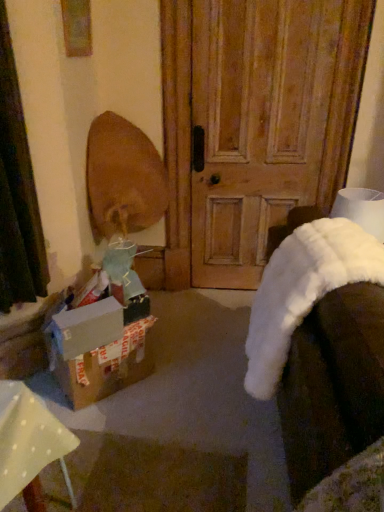
Question: From the image's perspective, is brown cardboard box at lower left below wooden door at center?

Choices:
 (A) no
 (B) yes

Answer: (B)

Question: Considering the relative sizes of brown cardboard box at lower left and wooden door at center in the image provided, is brown cardboard box at lower left taller than wooden door at center?

Choices:
 (A) yes
 (B) no

Answer: (B)

Question: Is brown cardboard box at lower left positioned beyond the bounds of wooden door at center?

Choices:
 (A) yes
 (B) no

Answer: (A)

Question: Considering the relative sizes of brown cardboard box at lower left and wooden door at center in the image provided, is brown cardboard box at lower left bigger than wooden door at center?

Choices:
 (A) yes
 (B) no

Answer: (B)

Question: Is brown cardboard box at lower left further to the viewer compared to wooden door at center?

Choices:
 (A) no
 (B) yes

Answer: (A)

Question: Is brown cardboard box at lower left facing towards wooden door at center?

Choices:
 (A) no
 (B) yes

Answer: (A)

Question: Can you confirm if brown cardboard box at lower left is smaller than white fluffy blanket at lower right?

Choices:
 (A) yes
 (B) no

Answer: (A)

Question: Is brown cardboard box at lower left bigger than white fluffy blanket at lower right?

Choices:
 (A) no
 (B) yes

Answer: (A)

Question: From a real-world perspective, is brown cardboard box at lower left on white fluffy blanket at lower right?

Choices:
 (A) yes
 (B) no

Answer: (B)

Question: From the image's perspective, is brown cardboard box at lower left located beneath white fluffy blanket at lower right?

Choices:
 (A) no
 (B) yes

Answer: (B)

Question: Considering the relative sizes of brown cardboard box at lower left and white fluffy blanket at lower right in the image provided, is brown cardboard box at lower left wider than white fluffy blanket at lower right?

Choices:
 (A) no
 (B) yes

Answer: (A)

Question: From the image's perspective, is brown cardboard box at lower left on white fluffy blanket at lower right?

Choices:
 (A) no
 (B) yes

Answer: (A)

Question: Does cardboard box at lower left have a greater height compared to wooden door at center?

Choices:
 (A) yes
 (B) no

Answer: (B)